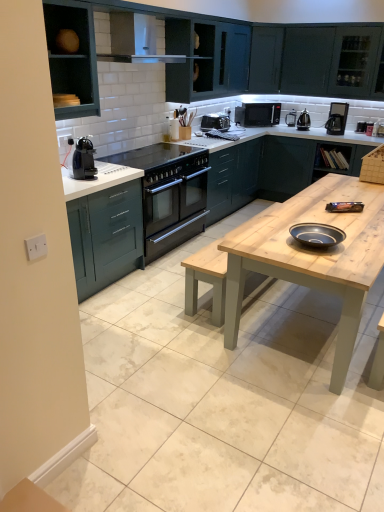
You are a GUI agent. You are given a task and a screenshot of the screen. Output one action in this format:
    pyautogui.click(x=<x>, y=<y>)
    Task: Click on the vacant region under matte blue bowl at center (from a real-world perspective)
    The height and width of the screenshot is (512, 384).
    Given the screenshot: What is the action you would take?
    coord(324,240)